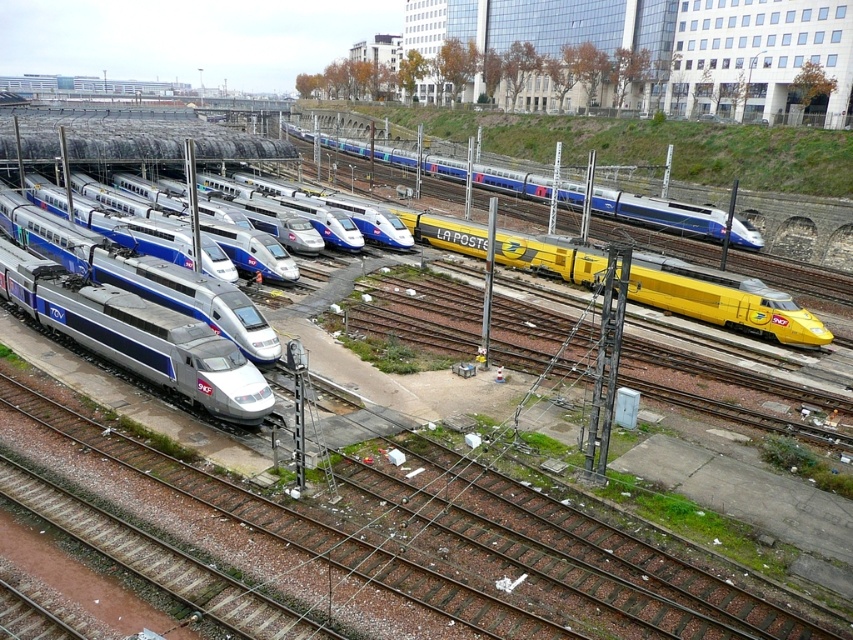
Does silver metallic train at left have a lesser height compared to yellow metallic train at center?

Yes, silver metallic train at left is shorter than yellow metallic train at center.

Is silver metallic train at left above yellow metallic train at center?

No, silver metallic train at left is not above yellow metallic train at center.

Find the location of a particular element. silver metallic train at left is located at coordinates (138, 336).

The height and width of the screenshot is (640, 853). What are the coordinates of `silver metallic train at left` in the screenshot? It's located at (138, 336).